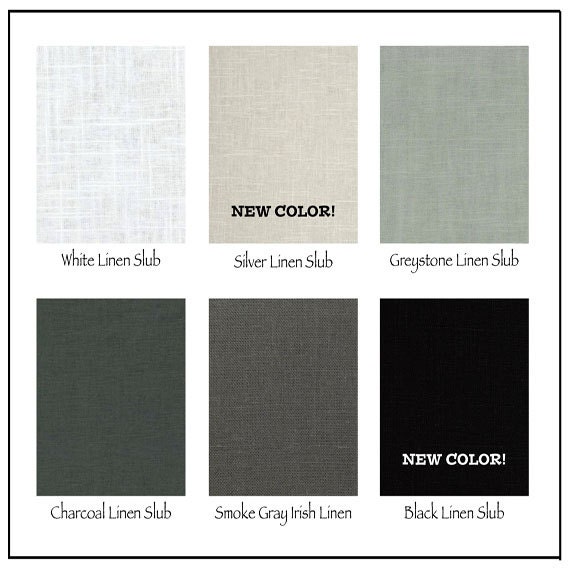
Where is `linen`? The width and height of the screenshot is (570, 570). linen is located at coordinates (287, 259).